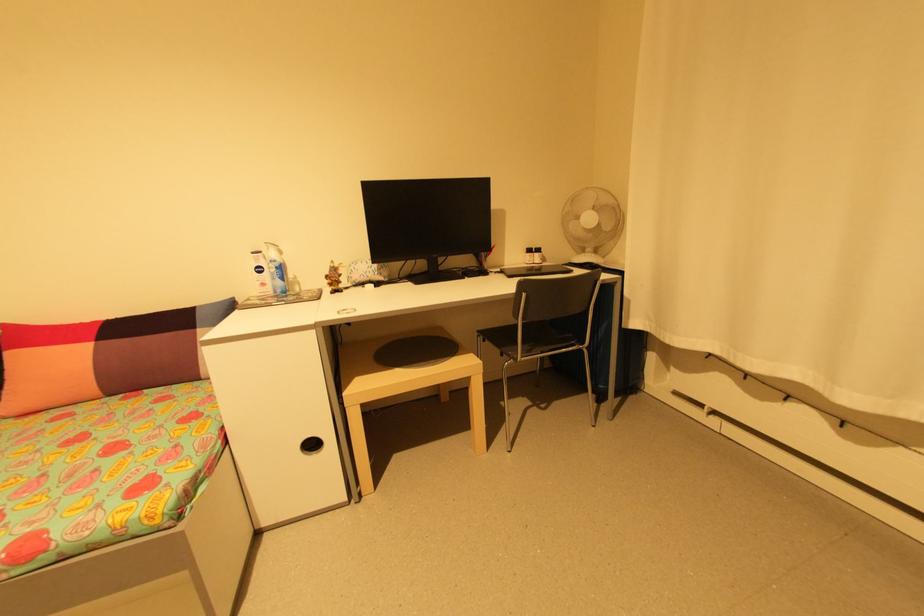
This screenshot has width=924, height=616. Describe the element at coordinates (416, 351) in the screenshot. I see `a stool sitting surface` at that location.